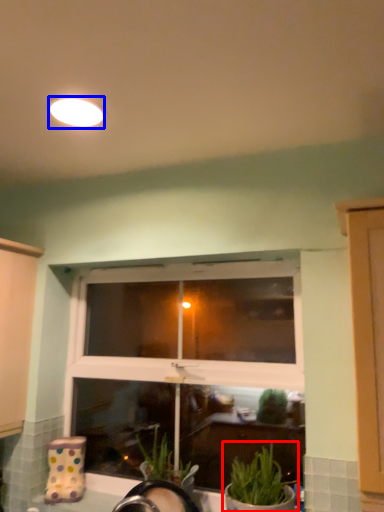
Question: Among these objects, which one is farthest to the camera, houseplant (highlighted by a red box) or lighting (highlighted by a blue box)?

Choices:
 (A) houseplant
 (B) lighting

Answer: (A)